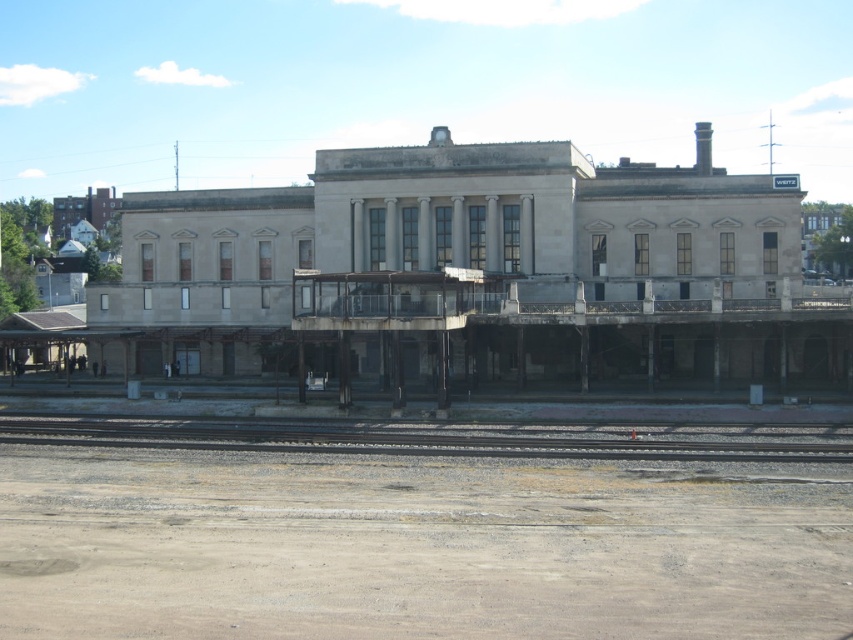
Is gray concrete railway station at center above gray gravel train track at lower center?

Indeed, gray concrete railway station at center is positioned over gray gravel train track at lower center.

Is point (807, 364) positioned in front of point (134, 422)?

No, (807, 364) is further to viewer.

Is point (552, 340) closer to camera compared to point (62, 442)?

No, (552, 340) is behind (62, 442).

Where is `gray concrete railway station at center`? The image size is (853, 640). gray concrete railway station at center is located at coordinates (469, 269).